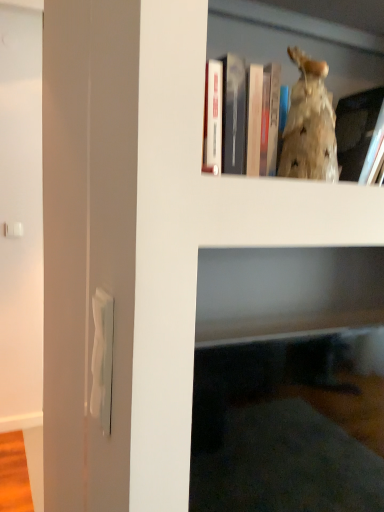
Measure the distance between wooden statue at upper center and camera.

wooden statue at upper center and camera are 33.29 inches apart.

The image size is (384, 512). What do you see at coordinates (299, 46) in the screenshot?
I see `wooden statue at upper center` at bounding box center [299, 46].

Identify the location of wooden statue at upper center. The height and width of the screenshot is (512, 384). (299, 46).

In order to face wooden statue at upper center, should I rotate leftwards or rightwards?

A 16.639 degree turn to the right will do.

Image resolution: width=384 pixels, height=512 pixels. Find the location of `wooden statue at upper center`. wooden statue at upper center is located at coordinates (299, 46).